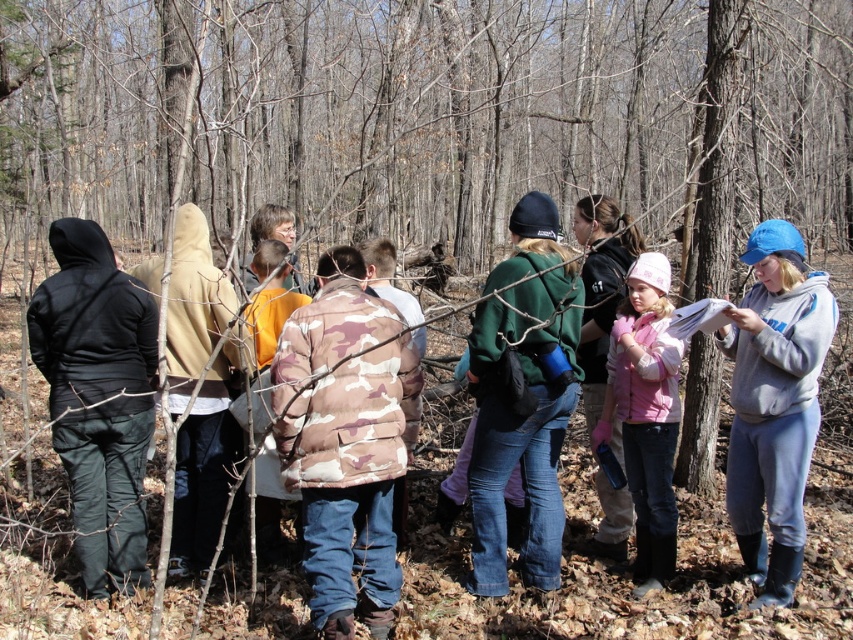
Can you confirm if green fleece jacket at center is taller than pink fleece jacket at center?

Correct, green fleece jacket at center is much taller as pink fleece jacket at center.

What do you see at coordinates (521, 396) in the screenshot? The image size is (853, 640). I see `green fleece jacket at center` at bounding box center [521, 396].

Is point (473, 586) positioned behind point (639, 314)?

That is False.

Image resolution: width=853 pixels, height=640 pixels. In order to click on green fleece jacket at center in this screenshot , I will do click(521, 396).

Who is more distant from viewer, (534, 524) or (809, 317)?

The point (534, 524) is more distant.

Can you confirm if green fleece jacket at center is positioned to the right of gray fleece sweatshirt at right?

No, green fleece jacket at center is not to the right of gray fleece sweatshirt at right.

Describe the element at coordinates (521, 396) in the screenshot. I see `green fleece jacket at center` at that location.

Locate an element on the screen. The height and width of the screenshot is (640, 853). green fleece jacket at center is located at coordinates (521, 396).

Measure the distance from camo fabric jacket at center to gray fleece sweatshirt at right.

A distance of 5.82 feet exists between camo fabric jacket at center and gray fleece sweatshirt at right.

Is camo fabric jacket at center below gray fleece sweatshirt at right?

Indeed, camo fabric jacket at center is positioned under gray fleece sweatshirt at right.

Which is behind, point (339, 300) or point (764, 356)?

Positioned behind is point (764, 356).

Where is `camo fabric jacket at center`? camo fabric jacket at center is located at coordinates (346, 440).